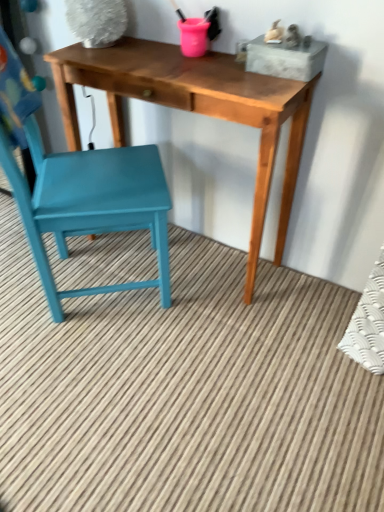
This screenshot has width=384, height=512. Find the location of `vacant space in front of wooden table at center`. vacant space in front of wooden table at center is located at coordinates [181, 366].